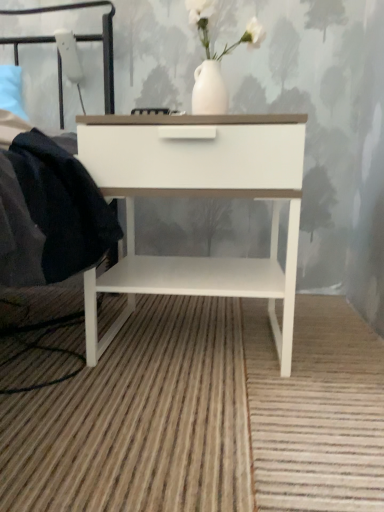
Question: Is black metal headboard at upper left not inside white glossy nightstand at center?

Choices:
 (A) yes
 (B) no

Answer: (A)

Question: Can you confirm if black metal headboard at upper left is smaller than white glossy nightstand at center?

Choices:
 (A) yes
 (B) no

Answer: (A)

Question: Is black metal headboard at upper left oriented towards white glossy nightstand at center?

Choices:
 (A) no
 (B) yes

Answer: (A)

Question: Is black metal headboard at upper left closer to camera compared to white glossy nightstand at center?

Choices:
 (A) no
 (B) yes

Answer: (A)

Question: From a real-world perspective, does black metal headboard at upper left stand above white glossy nightstand at center?

Choices:
 (A) no
 (B) yes

Answer: (B)

Question: Is black metal headboard at upper left touching white glossy nightstand at center?

Choices:
 (A) no
 (B) yes

Answer: (A)

Question: Does white glossy nightstand at center have a larger size compared to black metal headboard at upper left?

Choices:
 (A) yes
 (B) no

Answer: (A)

Question: Is white glossy nightstand at center with black metal headboard at upper left?

Choices:
 (A) no
 (B) yes

Answer: (A)

Question: Is white glossy nightstand at center wider than black metal headboard at upper left?

Choices:
 (A) no
 (B) yes

Answer: (A)

Question: Is white glossy nightstand at center to the right of black metal headboard at upper left from the viewer's perspective?

Choices:
 (A) no
 (B) yes

Answer: (B)

Question: Is white glossy nightstand at center behind black metal headboard at upper left?

Choices:
 (A) yes
 (B) no

Answer: (B)

Question: From the image's perspective, is white glossy nightstand at center below black metal headboard at upper left?

Choices:
 (A) yes
 (B) no

Answer: (A)

Question: Considering the positions of black metal headboard at upper left and white glossy nightstand at center in the image, is black metal headboard at upper left bigger or smaller than white glossy nightstand at center?

Choices:
 (A) small
 (B) big

Answer: (A)